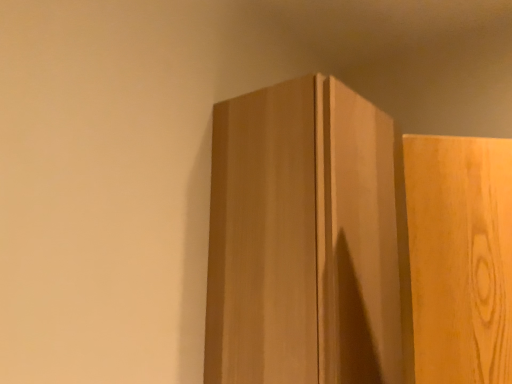
Question: Should I look upward or downward to see light brown wood cupboard at upper right?

Choices:
 (A) down
 (B) up

Answer: (A)